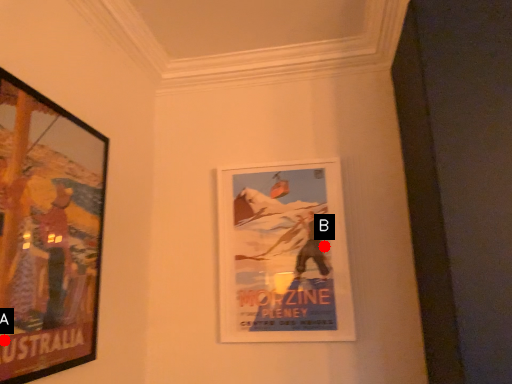
Question: Two points are circled on the image, labeled by A and B beside each circle. Which point is closer to the camera?

Choices:
 (A) A is closer
 (B) B is closer

Answer: (A)